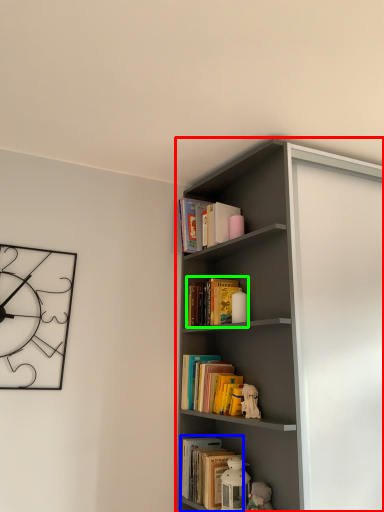
Question: Considering the real-world distances, which object is closest to shelf (highlighted by a red box)? book (highlighted by a blue box) or book (highlighted by a green box).

Choices:
 (A) book
 (B) book

Answer: (B)